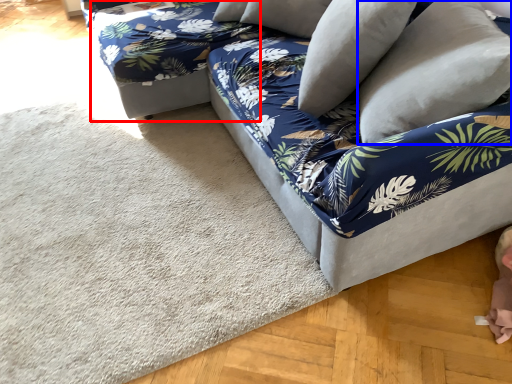
Question: Which object is further to the camera taking this photo, bean bag chair (highlighted by a red box) or pillow (highlighted by a blue box)?

Choices:
 (A) bean bag chair
 (B) pillow

Answer: (A)